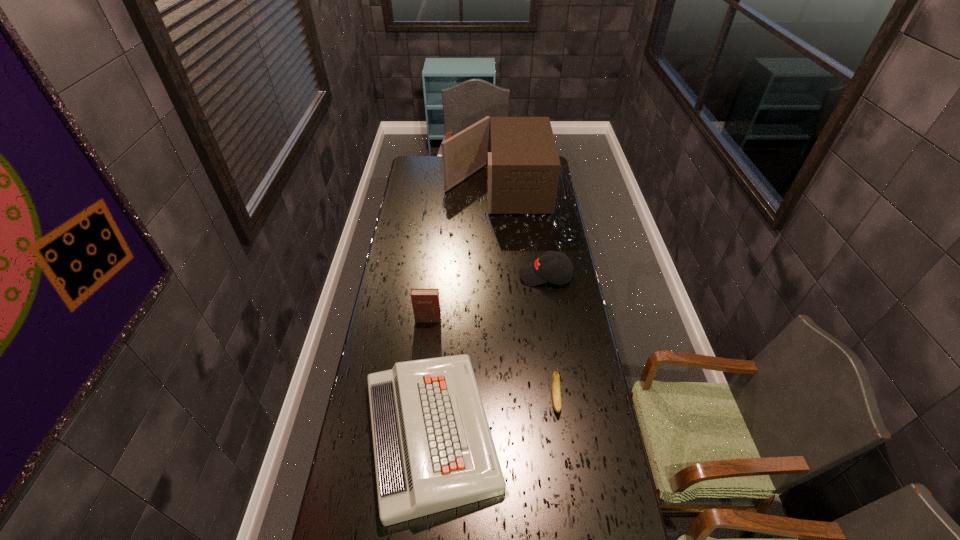
Where is `unoccupied position between the computer keyboard and the baseball cap`? This screenshot has width=960, height=540. unoccupied position between the computer keyboard and the baseball cap is located at coordinates (489, 354).

Identify the location of empty location between the baseball cap and the shortest object. The width and height of the screenshot is (960, 540). (489, 354).

Identify the location of free space that is in between the fourth nearest object and the shortest object. This screenshot has height=540, width=960. (489, 354).

Locate an element on the screen. This screenshot has width=960, height=540. empty space that is in between the third nearest object and the banana is located at coordinates (492, 360).

Locate which object ranks third in proximity to the diary. Please provide its 2D coordinates. Your answer should be formatted as a tuple, i.e. [(x, y)], where the tuple contains the x and y coordinates of a point satisfying the conditions above.

[(555, 383)]

You are a GUI agent. You are given a task and a screenshot of the screen. Output one action in this format:
    pyautogui.click(x=<x>, y=<y>)
    Task: Click on the second closest object to the tallest object
    
    Given the screenshot: What is the action you would take?
    pyautogui.click(x=426, y=306)

Identify the location of free location that satisfies the following two spatial constraints: 1. on the front cover of the third nearest object; 2. on the left side of the computer keyboard. The height and width of the screenshot is (540, 960). (416, 433).

You are a GUI agent. You are given a task and a screenshot of the screen. Output one action in this format:
    pyautogui.click(x=<x>, y=<y>)
    Task: Click on the free spot that satisfies the following two spatial constraints: 1. on the front-facing side of the baseball cap; 2. on the front cover of the second tallest object
    
    Given the screenshot: What is the action you would take?
    pyautogui.click(x=551, y=319)

Identify the location of free space that satisfies the following two spatial constraints: 1. with the door open on the front of the microwave oven; 2. on the front cover of the diary. (501, 319).

Image resolution: width=960 pixels, height=540 pixels. Identify the location of vacant space that satisfies the following two spatial constraints: 1. with the door open on the front of the farthest object; 2. on the front cover of the diary. (501, 319).